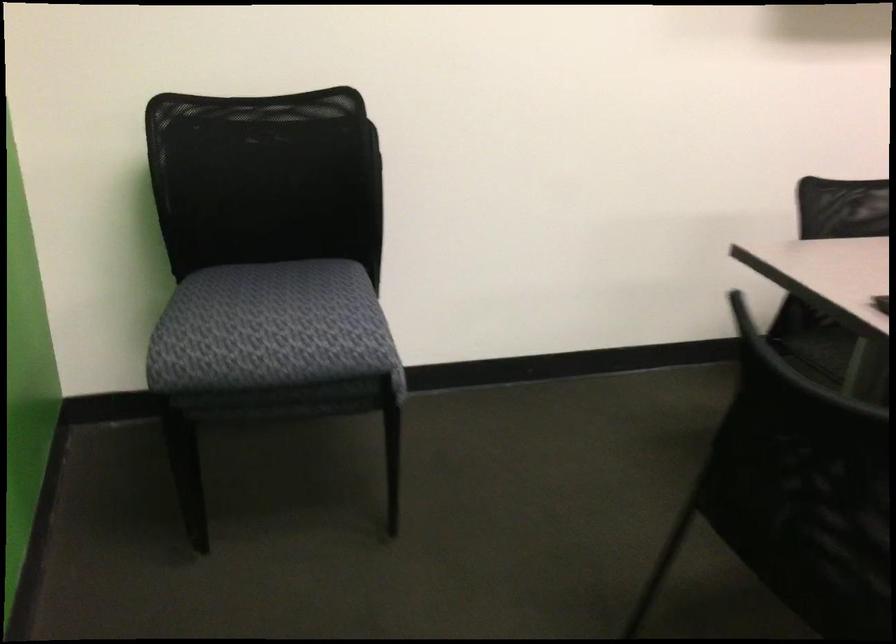
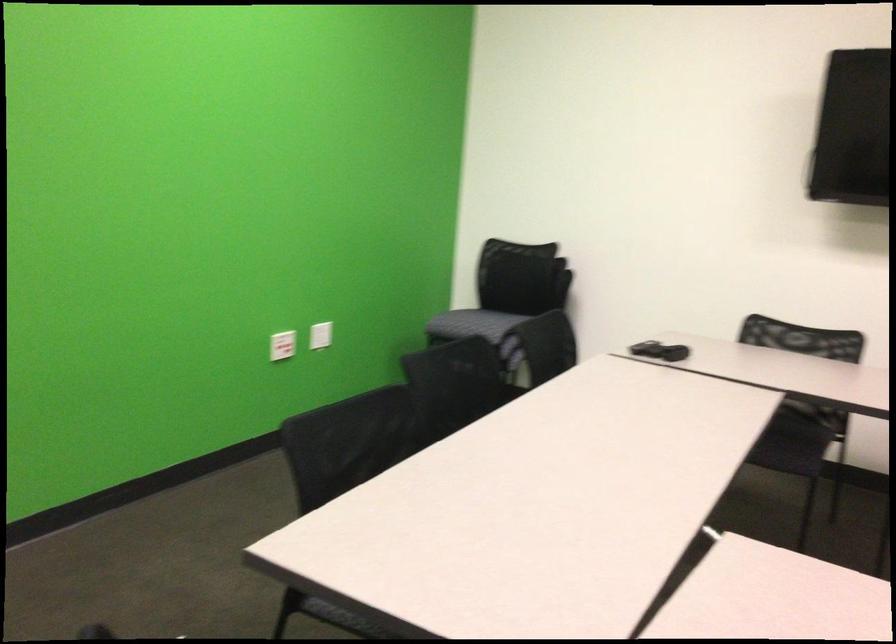
Locate, in the second image, the point that corresponds to [350,379] in the first image.

(471, 324)